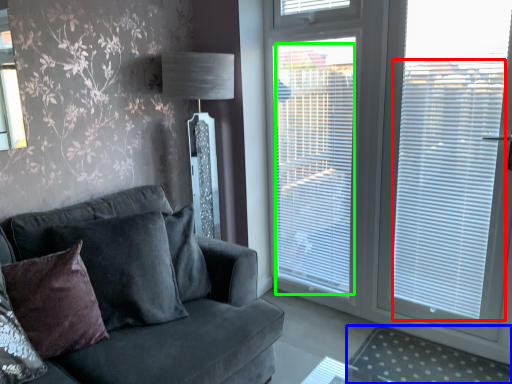
Question: Which object is the farthest from blind (highlighted by a red box)? Choose among these: plain (highlighted by a blue box) or blind (highlighted by a green box).

Choices:
 (A) plain
 (B) blind

Answer: (A)